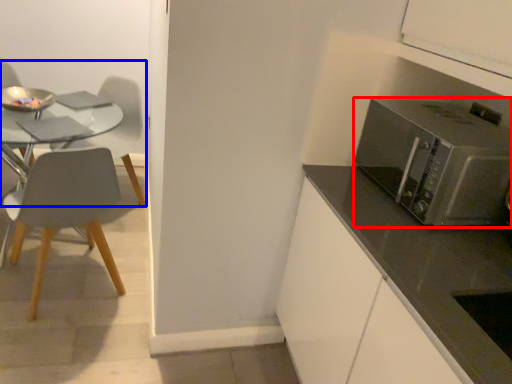
Question: Which object is closer to the camera taking this photo, microwave oven (highlighted by a red box) or chair (highlighted by a blue box)?

Choices:
 (A) microwave oven
 (B) chair

Answer: (A)